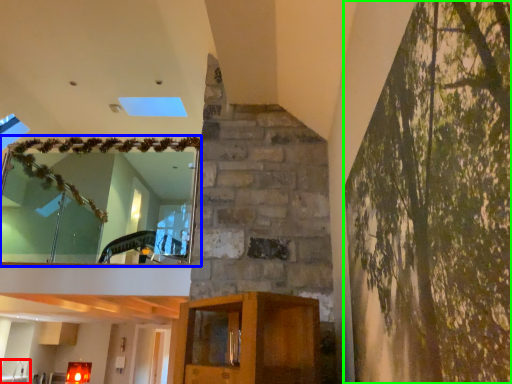
Question: Which object is the farthest from sink (highlighted by a red box)? Choose among these: window (highlighted by a blue box) or tree (highlighted by a green box).

Choices:
 (A) window
 (B) tree

Answer: (B)